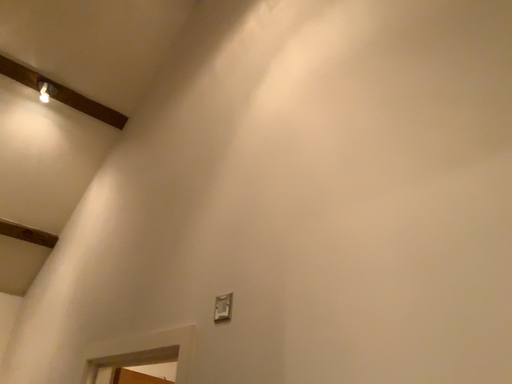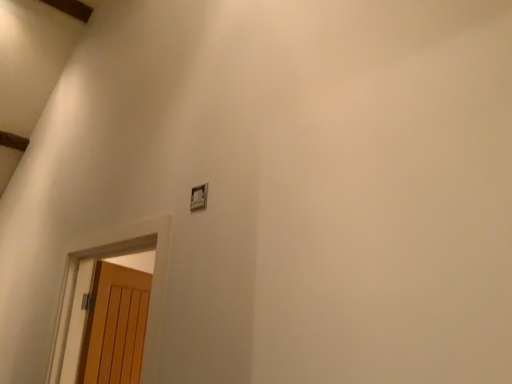
Question: How did the camera likely rotate when shooting the video?

Choices:
 (A) rotated upward
 (B) rotated downward

Answer: (B)